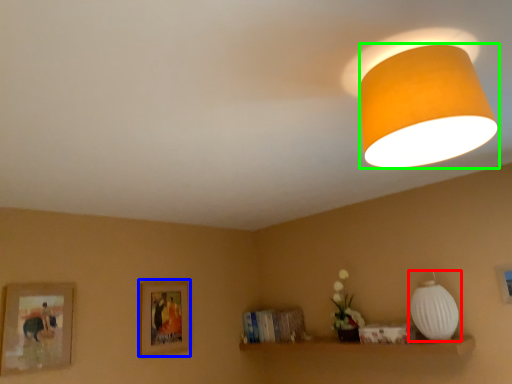
Question: Which object is the farthest from lamp (highlighted by a red box)? Choose among these: picture frame (highlighted by a blue box) or lamp (highlighted by a green box).

Choices:
 (A) picture frame
 (B) lamp

Answer: (A)